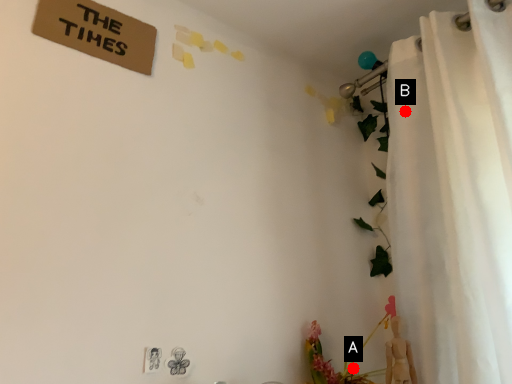
Question: Two points are circled on the image, labeled by A and B beside each circle. Which point is farther from the camera taking this photo?

Choices:
 (A) A is further
 (B) B is further

Answer: (A)